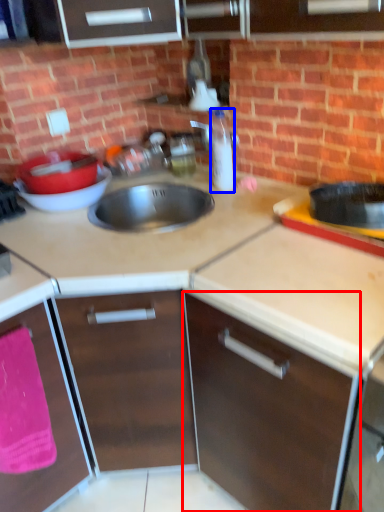
Question: Which object appears closest to the camera in this image, cabinetry (highlighted by a red box) or bottle (highlighted by a blue box)?

Choices:
 (A) cabinetry
 (B) bottle

Answer: (A)